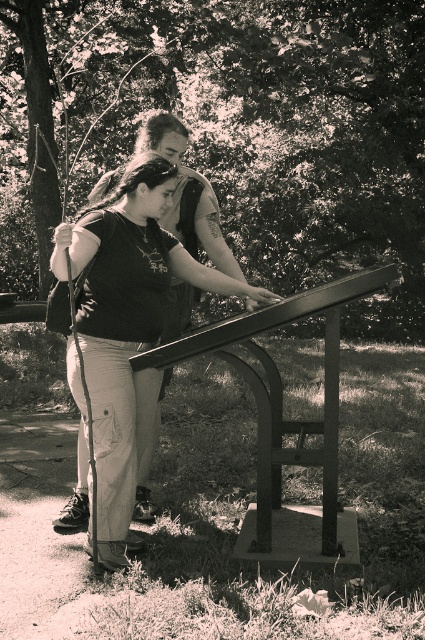
Question: Which point is closer to the camera?

Choices:
 (A) matte black shirt at center
 (B) metallic/smooth rail at center

Answer: (A)

Question: Is the position of matte black shirt at center less distant than that of metallic/smooth rail at center?

Choices:
 (A) no
 (B) yes

Answer: (B)

Question: In this image, where is matte black shirt at center located relative to metallic/smooth rail at center?

Choices:
 (A) below
 (B) above

Answer: (B)

Question: Does matte black shirt at center come in front of metallic/smooth rail at center?

Choices:
 (A) yes
 (B) no

Answer: (A)

Question: Which object is farther from the camera taking this photo?

Choices:
 (A) matte black shirt at center
 (B) metallic/smooth rail at center

Answer: (B)

Question: Which object is farther from the camera taking this photo?

Choices:
 (A) matte black shirt at center
 (B) metallic/smooth rail at center

Answer: (B)